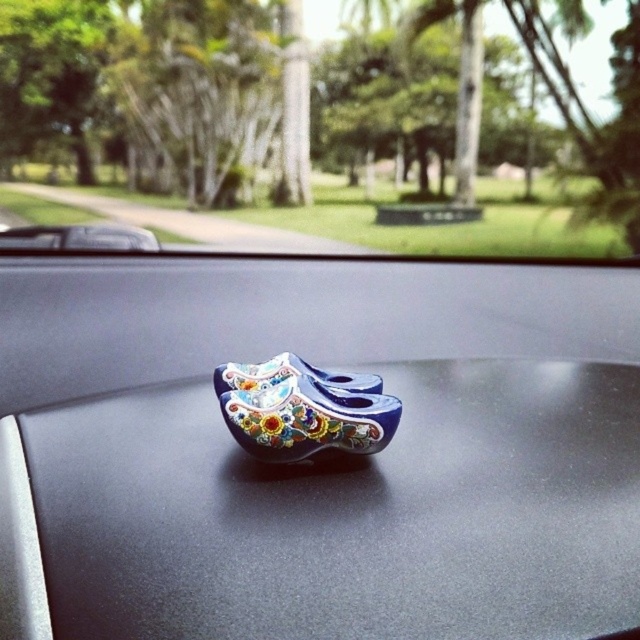
Question: Which point appears farthest from the camera in this image?

Choices:
 (A) (321, 448)
 (B) (104, 433)
 (C) (509, 189)

Answer: (C)

Question: Which of the following is the closest to the observer?

Choices:
 (A) [227, 417]
 (B) [240, 97]

Answer: (A)

Question: Among these objects, which one is nearest to the camera?

Choices:
 (A) blue glossy wooden shoes at center
 (B) glossy ceramic clogs at center

Answer: (B)

Question: Can you confirm if glossy ceramic clogs at center is positioned to the right of blue glossy wooden shoes at center?

Choices:
 (A) yes
 (B) no

Answer: (A)

Question: Is glossy ceramic clogs at center positioned in front of transparent glass car window at center?

Choices:
 (A) yes
 (B) no

Answer: (A)

Question: Is glossy ceramic clogs at center to the left of transparent glass car window at center from the viewer's perspective?

Choices:
 (A) no
 (B) yes

Answer: (A)